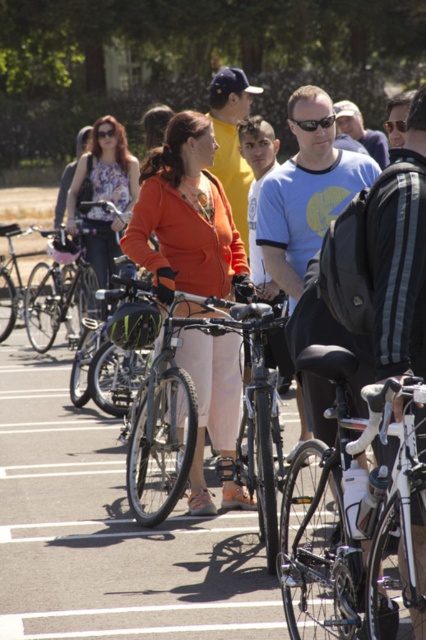
From the picture: You are at the point labeled point (354, 588) and want to walk to the point labeled point (112, 314). Given the scene, will you have to walk towards the bicycles or away from them?

Since point (354, 588) is in front of point (112, 314), you will have to walk away from the bicycles to reach point (112, 314).

You are standing at the point marked by the coordinates point (x=198, y=419) in the image. What object are you directly facing?

The point (x=198, y=419) indicates a shiny black bicycle at center, so you are directly facing the shiny black bicycle at center.